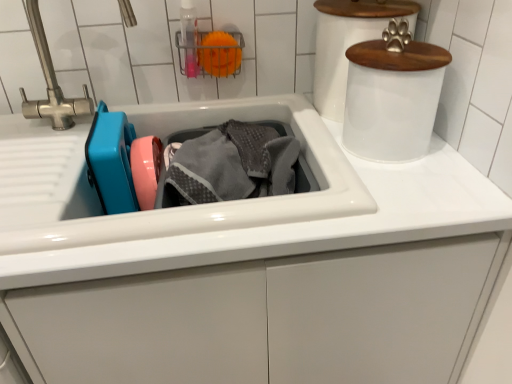
Question: Does white frosted plastic canister at upper right, the first appliance from the front, have a smaller size compared to gray terry towel at center?

Choices:
 (A) yes
 (B) no

Answer: (A)

Question: From the image's perspective, does white frosted plastic canister at upper right, the first appliance from the front, appear lower than gray terry towel at center?

Choices:
 (A) yes
 (B) no

Answer: (B)

Question: From a real-world perspective, is white frosted plastic canister at upper right, the first appliance from the front, positioned over gray terry towel at center based on gravity?

Choices:
 (A) no
 (B) yes

Answer: (B)

Question: Is white frosted plastic canister at upper right, which ranks as the second appliance in back-to-front order, directly adjacent to gray terry towel at center?

Choices:
 (A) no
 (B) yes

Answer: (A)

Question: Can you confirm if white frosted plastic canister at upper right, which ranks as the second appliance in back-to-front order, is bigger than gray terry towel at center?

Choices:
 (A) no
 (B) yes

Answer: (A)

Question: From a real-world perspective, is white glossy sink at center physically located above or below gray terry towel at center?

Choices:
 (A) above
 (B) below

Answer: (A)

Question: In the image, is white glossy sink at center positioned in front of or behind gray terry towel at center?

Choices:
 (A) front
 (B) behind

Answer: (A)

Question: In the image, is white glossy sink at center on the left side or the right side of gray terry towel at center?

Choices:
 (A) left
 (B) right

Answer: (A)

Question: Is white glossy sink at center spatially inside gray terry towel at center, or outside of it?

Choices:
 (A) inside
 (B) outside

Answer: (B)

Question: From the image's perspective, is white glossy paw print at upper right, which ranks as the 2th appliance in front-to-back order, positioned above or below transparent plastic bottle at upper center?

Choices:
 (A) above
 (B) below

Answer: (B)

Question: Looking at the image, does white glossy paw print at upper right, placed as the 1th appliance when sorted from back to front, seem bigger or smaller compared to transparent plastic bottle at upper center?

Choices:
 (A) big
 (B) small

Answer: (A)

Question: Do you think white glossy paw print at upper right, placed as the 1th appliance when sorted from back to front, is within transparent plastic bottle at upper center, or outside of it?

Choices:
 (A) inside
 (B) outside

Answer: (B)

Question: In terms of height, does white glossy paw print at upper right, which ranks as the 2th appliance in front-to-back order, look taller or shorter compared to transparent plastic bottle at upper center?

Choices:
 (A) tall
 (B) short

Answer: (A)

Question: Is white frosted plastic canister at upper right, which ranks as the second appliance in back-to-front order, situated inside white glossy sink at center or outside?

Choices:
 (A) inside
 (B) outside

Answer: (B)

Question: From the image's perspective, is white frosted plastic canister at upper right, which ranks as the second appliance in back-to-front order, above or below white glossy sink at center?

Choices:
 (A) below
 (B) above

Answer: (B)